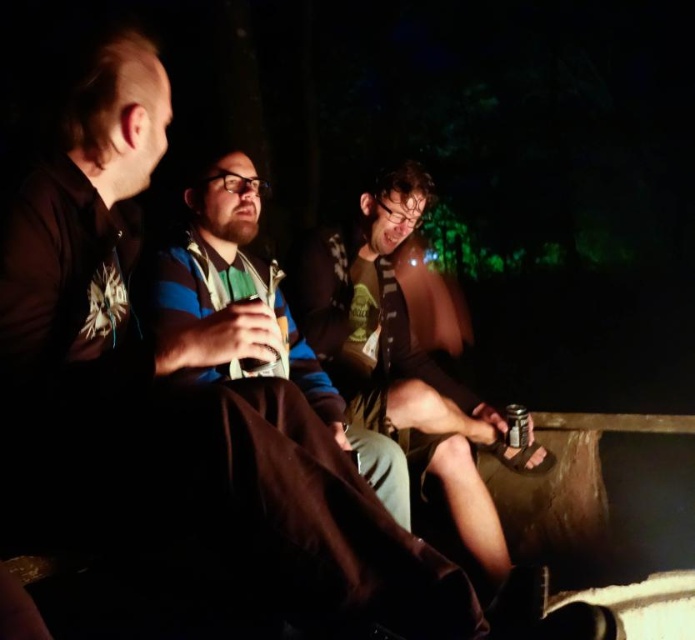
Does point (183, 252) come closer to viewer compared to point (512, 412)?

Yes.

Can you confirm if blue striped shirt at center is positioned above metallic can at lower right?

Yes, blue striped shirt at center is above metallic can at lower right.

Is point (329, 410) positioned in front of point (528, 412)?

That is True.

Locate an element on the screen. The width and height of the screenshot is (695, 640). blue striped shirt at center is located at coordinates (252, 317).

Is point (386, 394) positioned after point (247, 298)?

That is True.

Who is more distant from viewer, (343, 285) or (240, 368)?

The point (343, 285) is behind.

Is point (361, 420) positioned before point (247, 300)?

No, (361, 420) is behind (247, 300).

This screenshot has height=640, width=695. Identify the location of shiny black jacket at center. (400, 360).

Is shiny black jacket at center further to the viewer compared to metallic can at lower right?

That is False.

Which is in front, point (316, 285) or point (518, 404)?

Point (316, 285)

I want to click on shiny black jacket at center, so click(400, 360).